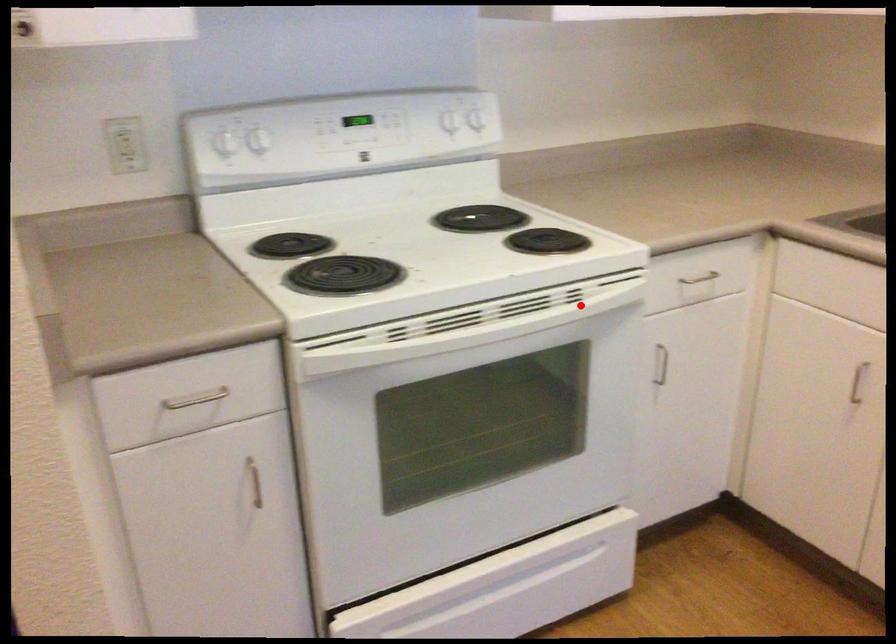
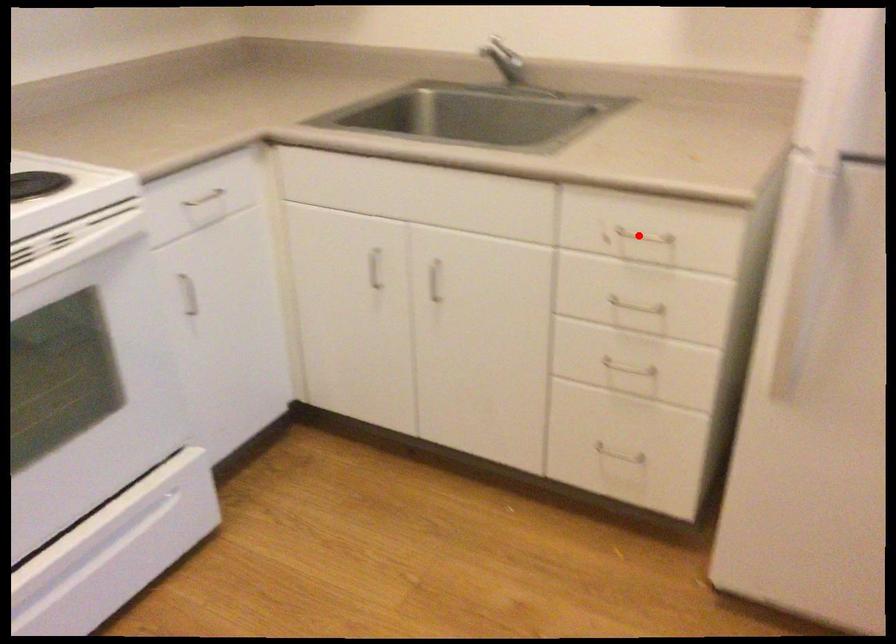
I am providing you with two images of the same scene from different viewpoints. A red point is marked on the first image and another point is marked on the second image. Is the red point in image1 aligned with the point shown in image2?

No